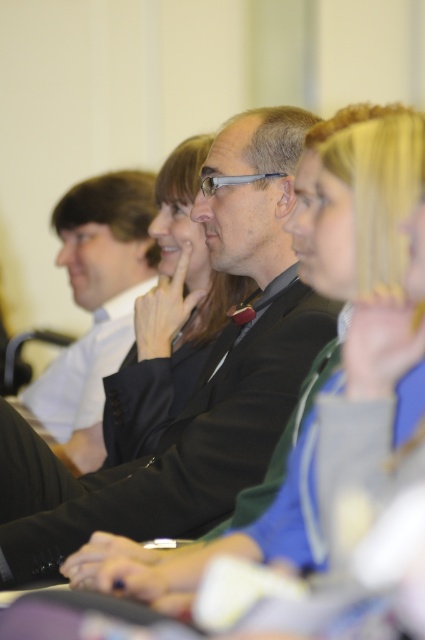
Question: Which is farther from the black matte suit at center?

Choices:
 (A) smooth black jacket at center
 (B) matte black suit at center

Answer: (B)

Question: Is black matte suit at center smaller than matte black suit at center?

Choices:
 (A) no
 (B) yes

Answer: (B)

Question: Which object is positioned closest to the smooth black jacket at center?

Choices:
 (A) matte black suit at center
 (B) black matte suit at center

Answer: (B)

Question: Can you confirm if black matte suit at center is positioned below smooth black jacket at center?

Choices:
 (A) no
 (B) yes

Answer: (B)

Question: Estimate the real-world distances between objects in this image. Which object is farther from the black matte suit at center?

Choices:
 (A) smooth black jacket at center
 (B) matte black suit at center

Answer: (B)

Question: Is matte black suit at center to the right of smooth black jacket at center from the viewer's perspective?

Choices:
 (A) yes
 (B) no

Answer: (B)